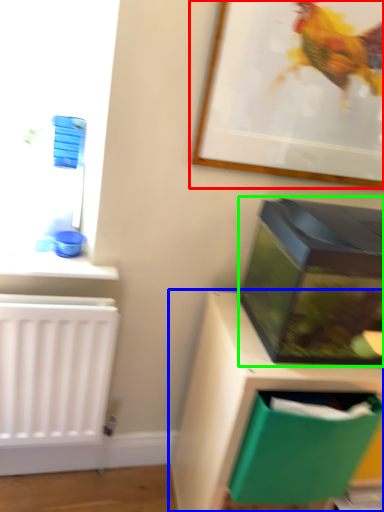
Question: Estimate the real-world distances between objects in this image. Which object is closer to picture frame (highlighted by a red box), furniture (highlighted by a blue box) or box (highlighted by a green box)?

Choices:
 (A) furniture
 (B) box

Answer: (B)